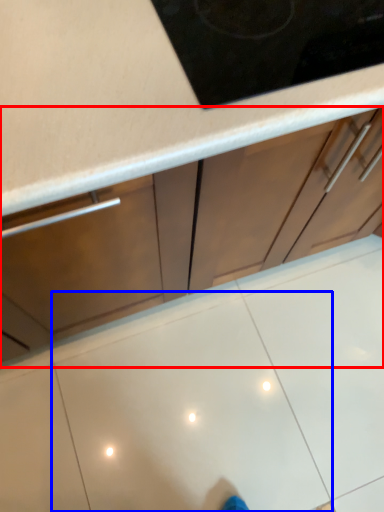
Question: Which point is closer to the camera, cabinetry (highlighted by a red box) or tile (highlighted by a blue box)?

Choices:
 (A) cabinetry
 (B) tile

Answer: (A)